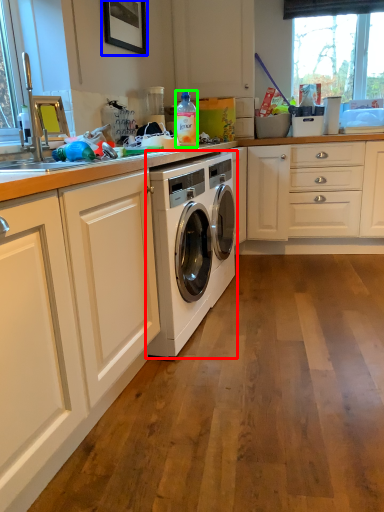
Question: Based on their relative distances, which object is farther from washing machine (highlighted by a red box)? Choose from picture frame (highlighted by a blue box) and bottle (highlighted by a green box).

Choices:
 (A) picture frame
 (B) bottle

Answer: (A)